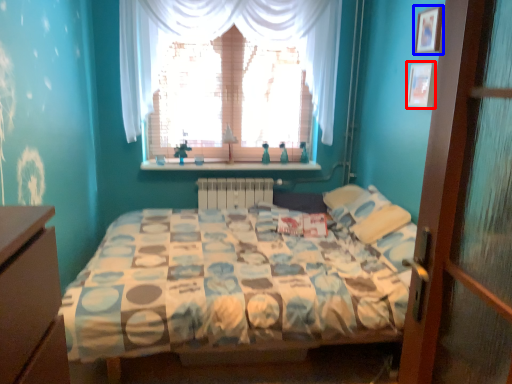
Question: Which object is closer to the camera taking this photo, picture frame (highlighted by a red box) or picture frame (highlighted by a blue box)?

Choices:
 (A) picture frame
 (B) picture frame

Answer: (B)